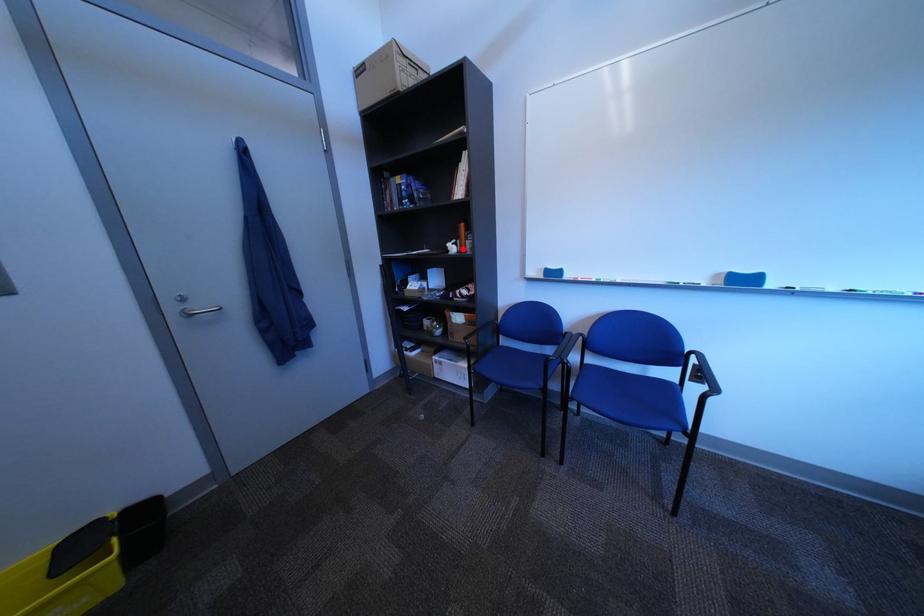
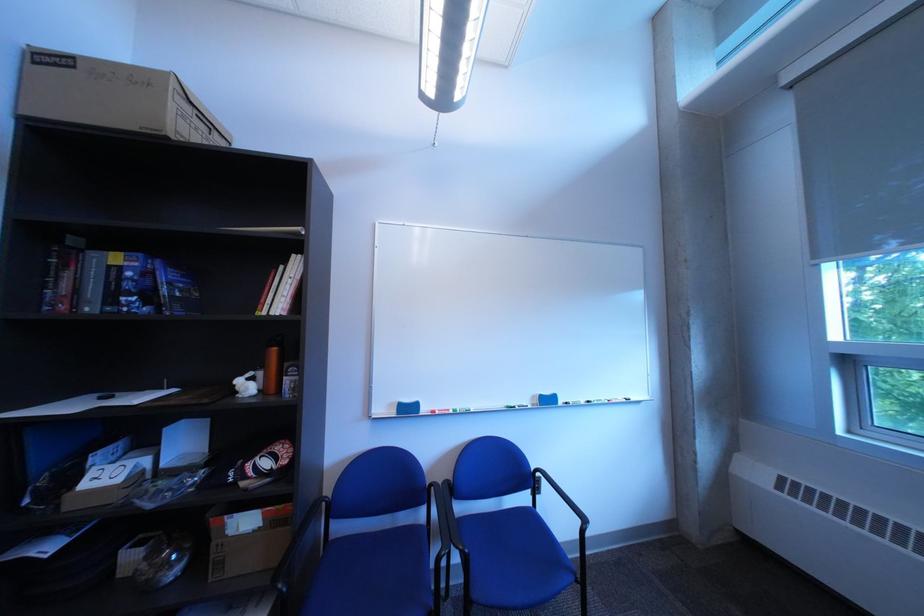
Question: I am providing you with two images of the same scene from different viewpoints. A red point is shown in image1. For the corresponding object point in image2, is it positioned nearer or farther from the camera?

Choices:
 (A) Nearer
 (B) Farther

Answer: (B)